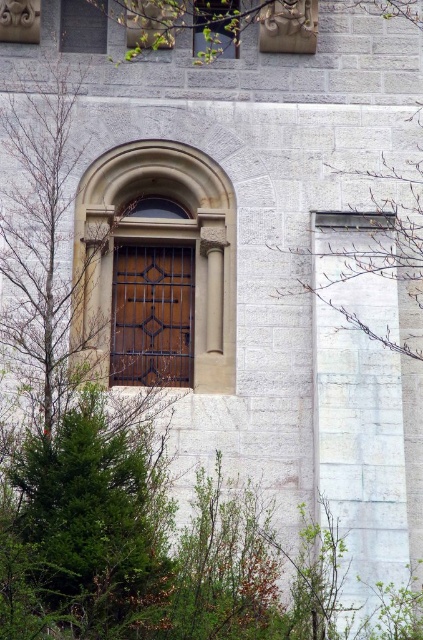
Is green leafy tree at center closer to the viewer compared to matte glass window at upper center?

Yes.

Is green leafy tree at center above matte glass window at upper center?

Actually, green leafy tree at center is below matte glass window at upper center.

You are a GUI agent. You are given a task and a screenshot of the screen. Output one action in this format:
    pyautogui.click(x=<x>, y=<y>)
    Task: Click on the green leafy tree at center
    The width and height of the screenshot is (423, 640).
    Given the screenshot: What is the action you would take?
    pyautogui.click(x=384, y=243)

Find the location of a particular element. The height and width of the screenshot is (640, 423). matte wood window at upper center is located at coordinates (216, 28).

In the scene shown: Is the position of matte wood window at upper center less distant than that of matte glass window at upper center?

Yes, matte wood window at upper center is closer to the viewer.

Locate an element on the screen. This screenshot has width=423, height=640. matte wood window at upper center is located at coordinates (216, 28).

Between green leafy tree at center and matte brown wooden door at upper center, which one has more height?

Standing taller between the two is green leafy tree at center.

Measure the distance from green leafy tree at center to matte brown wooden door at upper center.

The distance of green leafy tree at center from matte brown wooden door at upper center is 16.63 feet.

In order to click on green leafy tree at center in this screenshot , I will do `click(384, 243)`.

Identify the location of green leafy tree at center. (384, 243).